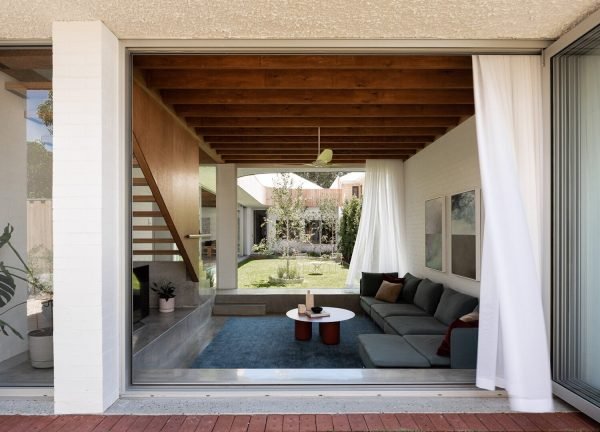
The image size is (600, 432). What are the coordinates of `wall` in the screenshot? It's located at (449, 177).